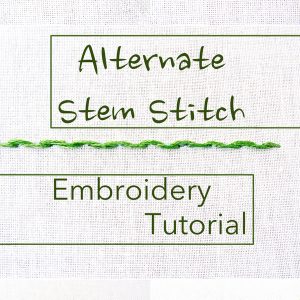
Locate an element on the screen. This screenshot has height=300, width=300. fabric pattern is located at coordinates (30, 84).